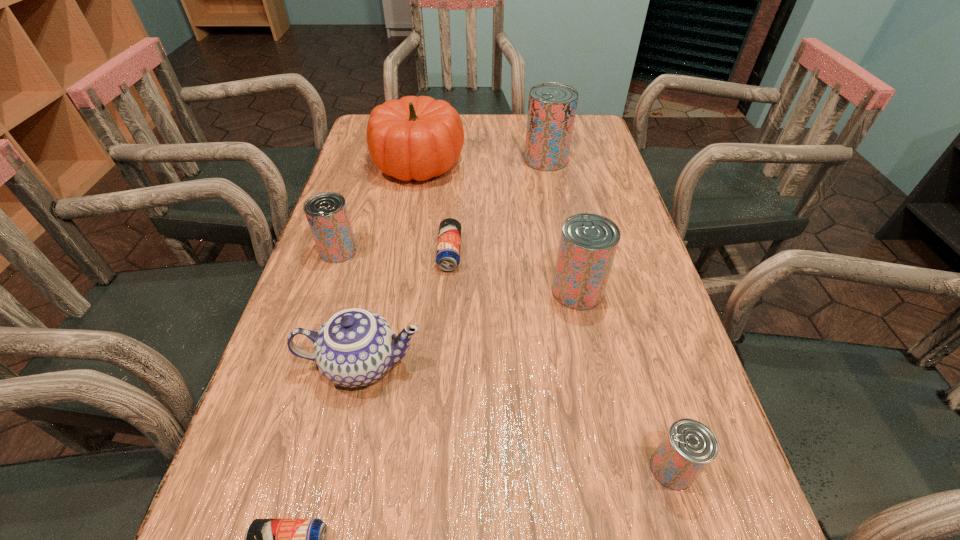
What are the coordinates of `the farthest beer can` in the screenshot? It's located at (552, 106).

Find the location of `the farthest red beer can`. the farthest red beer can is located at coordinates (552, 106).

You are a GUI agent. You are given a task and a screenshot of the screen. Output one action in this format:
    pyautogui.click(x=<x>, y=<y>)
    Task: Click on the pumpkin
    The image size is (960, 540).
    Given the screenshot: What is the action you would take?
    pyautogui.click(x=419, y=138)

Locate an element on the screen. This screenshot has width=960, height=540. the fifth shortest beer can is located at coordinates (588, 242).

At what (x,y) coordinates should I click in order to perform the action: click on the second biggest red beer can. Please return your answer as a coordinate pair (x, y). The width and height of the screenshot is (960, 540). Looking at the image, I should click on (588, 242).

Image resolution: width=960 pixels, height=540 pixels. Find the location of `blue chinaware`. blue chinaware is located at coordinates (355, 347).

I want to click on chinaware, so click(x=355, y=347).

The width and height of the screenshot is (960, 540). What are the coordinates of `the leftmost red beer can` in the screenshot? It's located at (327, 214).

The height and width of the screenshot is (540, 960). What are the coordinates of `the third tallest beer can` in the screenshot? It's located at (327, 214).

The image size is (960, 540). I want to click on the rightmost red beer can, so click(689, 446).